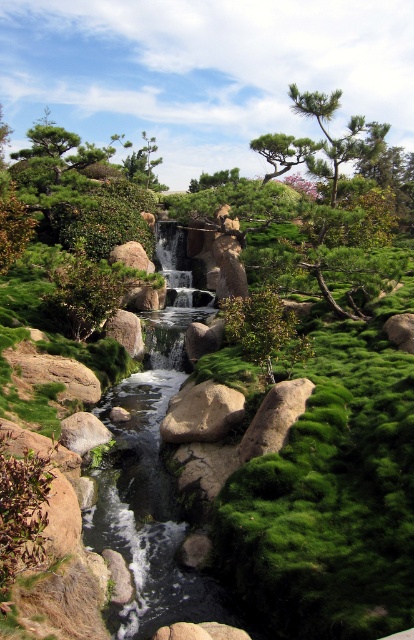
You are a gardener planning to prune the green mossy tree at upper left and the green mossy rock at center. Which object should you approach first if you want to start with the one closest to you?

You should start with the green mossy tree at upper left because it is closer to you than the green mossy rock at center.